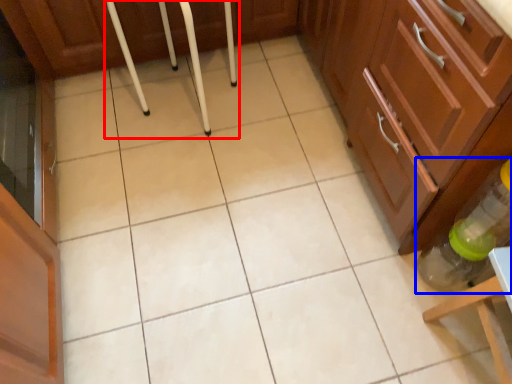
Question: Which object is closer to the camera taking this photo, bar stool (highlighted by a red box) or bottle (highlighted by a blue box)?

Choices:
 (A) bar stool
 (B) bottle

Answer: (B)